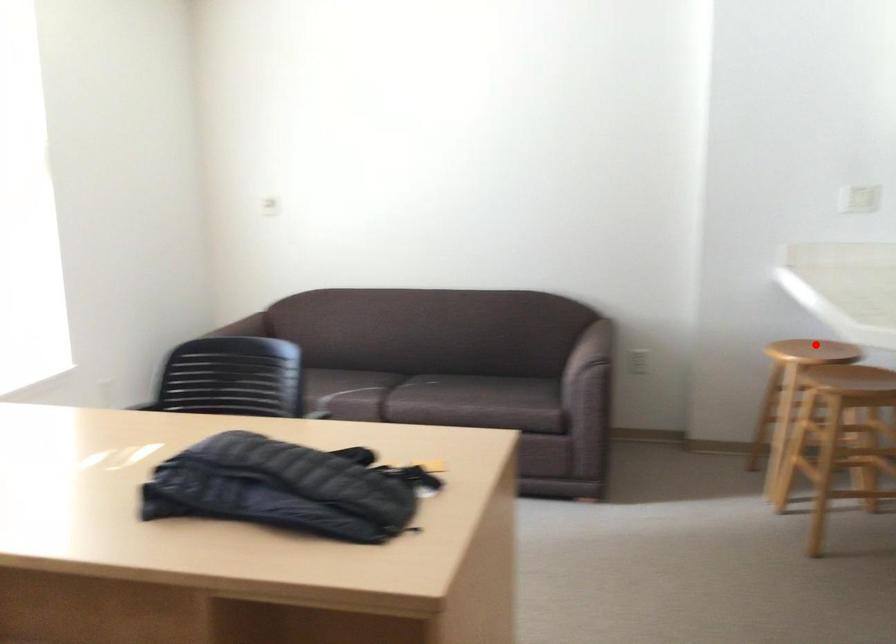
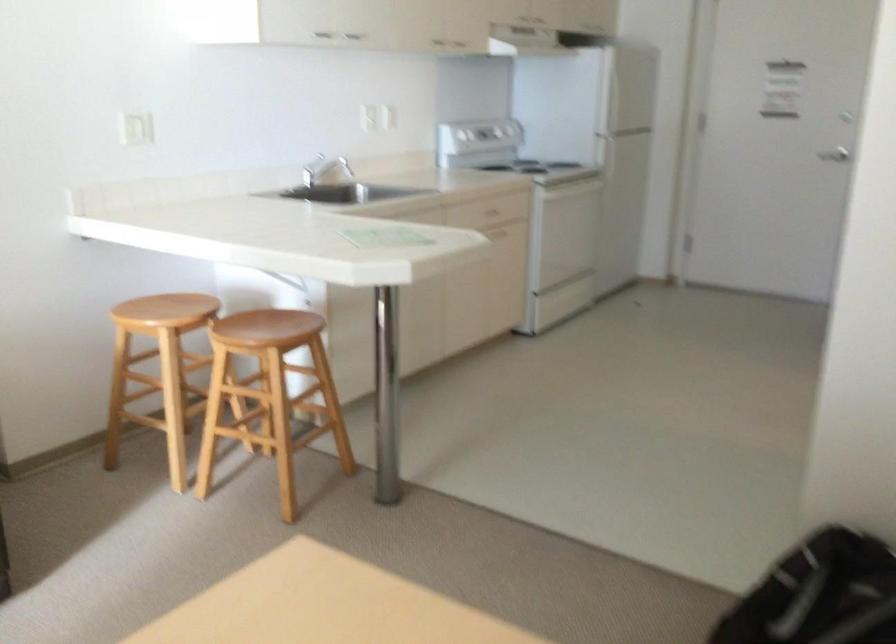
Find the pixel in the second image that matches the highlighted location in the first image.

(165, 310)